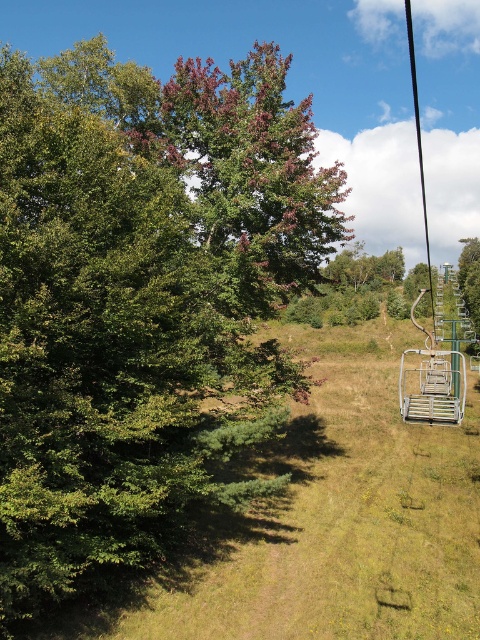
Question: Can you confirm if green leafy tree at center is smaller than metallic silver ski lift at right?

Choices:
 (A) yes
 (B) no

Answer: (A)

Question: Among these points, which one is nearest to the camera?

Choices:
 (A) (90, 257)
 (B) (214, 67)
 (C) (412, 412)

Answer: (C)

Question: Does green leafy tree at upper left have a greater width compared to green leafy tree at center?

Choices:
 (A) yes
 (B) no

Answer: (A)

Question: Which of the following is the closest to the observer?

Choices:
 (A) (144, 204)
 (B) (262, 208)

Answer: (A)

Question: Where is green leafy tree at center located in relation to metallic silver ski lift at right in the image?

Choices:
 (A) left
 (B) right

Answer: (A)

Question: Considering the real-world distances, which object is closest to the green leafy tree at upper left?

Choices:
 (A) metallic silver ski lift at right
 (B) green leafy tree at center

Answer: (B)